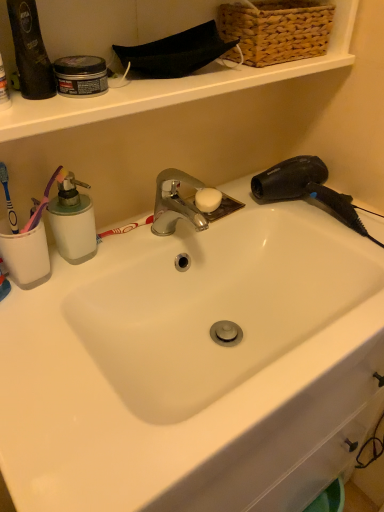
Question: Is white ceramic sink at center taller than black plastic hair dryer at upper right?

Choices:
 (A) yes
 (B) no

Answer: (A)

Question: From a real-world perspective, is white ceramic sink at center over black plastic hair dryer at upper right?

Choices:
 (A) yes
 (B) no

Answer: (B)

Question: Is the surface of white ceramic sink at center in direct contact with black plastic hair dryer at upper right?

Choices:
 (A) yes
 (B) no

Answer: (B)

Question: Is white ceramic sink at center facing towards black plastic hair dryer at upper right?

Choices:
 (A) yes
 (B) no

Answer: (B)

Question: Does white ceramic sink at center have a smaller size compared to black plastic hair dryer at upper right?

Choices:
 (A) no
 (B) yes

Answer: (A)

Question: Does point (286, 169) appear closer or farther from the camera than point (273, 35)?

Choices:
 (A) closer
 (B) farther

Answer: (B)

Question: Considering the relative positions of black plastic hair dryer at upper right and woven wicker basket at upper right in the image provided, is black plastic hair dryer at upper right to the left or to the right of woven wicker basket at upper right?

Choices:
 (A) right
 (B) left

Answer: (A)

Question: In terms of width, does black plastic hair dryer at upper right look wider or thinner when compared to woven wicker basket at upper right?

Choices:
 (A) thin
 (B) wide

Answer: (B)

Question: Is black plastic hair dryer at upper right in front of or behind woven wicker basket at upper right in the image?

Choices:
 (A) front
 (B) behind

Answer: (B)

Question: Is white ceramic sink at center in front of or behind blue plastic toothbrush at left in the image?

Choices:
 (A) front
 (B) behind

Answer: (A)

Question: Considering the positions of white ceramic sink at center and blue plastic toothbrush at left in the image, is white ceramic sink at center taller or shorter than blue plastic toothbrush at left?

Choices:
 (A) tall
 (B) short

Answer: (A)

Question: In the image, is white ceramic sink at center on the left side or the right side of blue plastic toothbrush at left?

Choices:
 (A) left
 (B) right

Answer: (B)

Question: From the image's perspective, is white ceramic sink at center above or below blue plastic toothbrush at left?

Choices:
 (A) above
 (B) below

Answer: (B)

Question: From the image's perspective, relative to blue plastic toothbrush at left, is black plastic hair dryer at upper right above or below?

Choices:
 (A) above
 (B) below

Answer: (A)

Question: From a real-world perspective, is black plastic hair dryer at upper right above or below blue plastic toothbrush at left?

Choices:
 (A) below
 (B) above

Answer: (A)